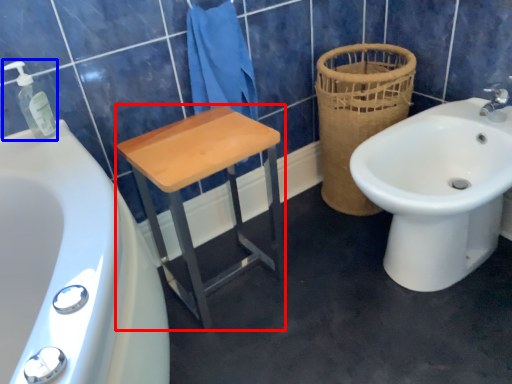
Question: Among these objects, which one is nearest to the camera, furniture (highlighted by a red box) or soap dispenser (highlighted by a blue box)?

Choices:
 (A) furniture
 (B) soap dispenser

Answer: (B)